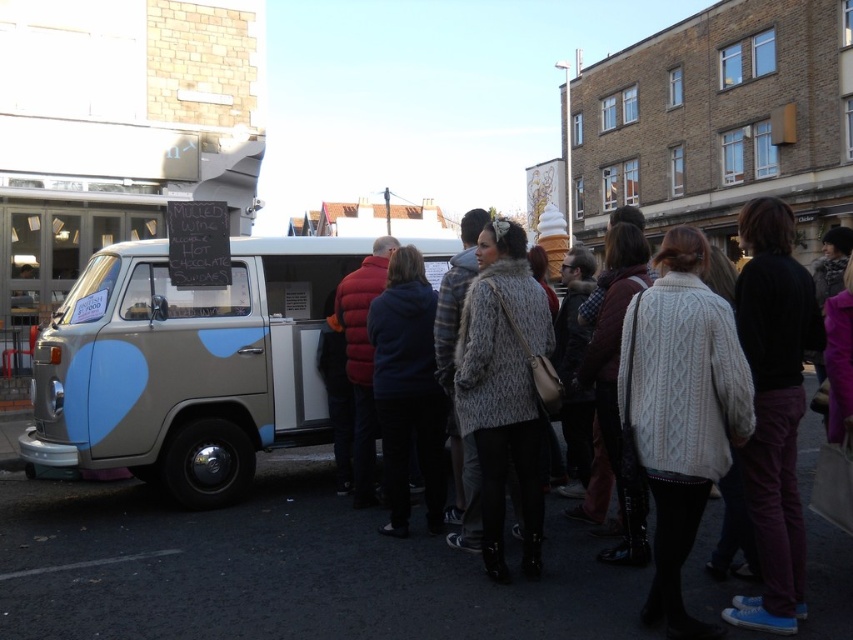
You are a delivery person standing at the edge of the crowd. You need to deliver a package to the matte beige van at center but there is a knitted sweater at center blocking the path. Can you reach the van without moving the sweater?

The matte beige van at center is 3.38 meters away from the knitted sweater at center. Since the sweater is an obstacle on the path, you can walk around it to reach the van as the distance allows enough space to maneuver around the sweater.

You are a customer standing in front of the matte beige van at center. You want to read the chalkboard sign on the van but are wearing a knitted sweater at center that might be in the way. Can you adjust your position to see the sign clearly?

The matte beige van at center is taller than the knitted sweater at center. Since the van is taller, you can step back or move the sweater out of the way to see the chalkboard sign on the van.